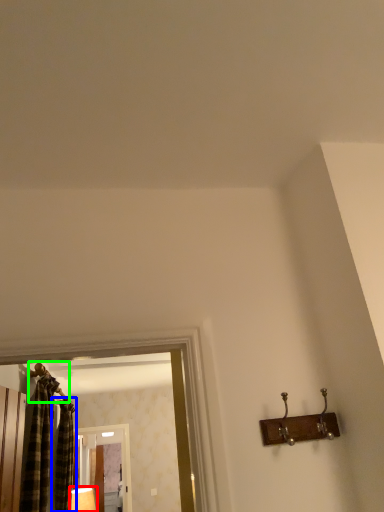
Question: Based on their relative distances, which object is nearer to lamp (highlighted by a red box)? Choose from shower curtain (highlighted by a blue box) and hanger (highlighted by a green box).

Choices:
 (A) shower curtain
 (B) hanger

Answer: (A)